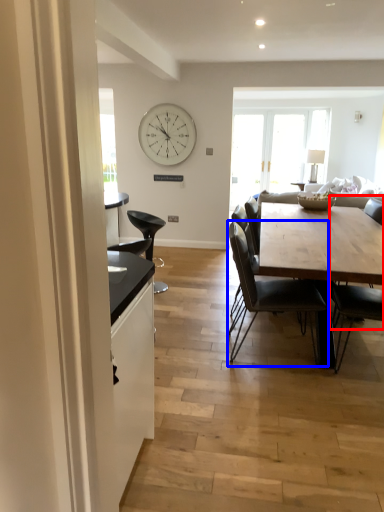
Question: Which object appears closest to the camera in this image, chair (highlighted by a red box) or chair (highlighted by a blue box)?

Choices:
 (A) chair
 (B) chair

Answer: (A)